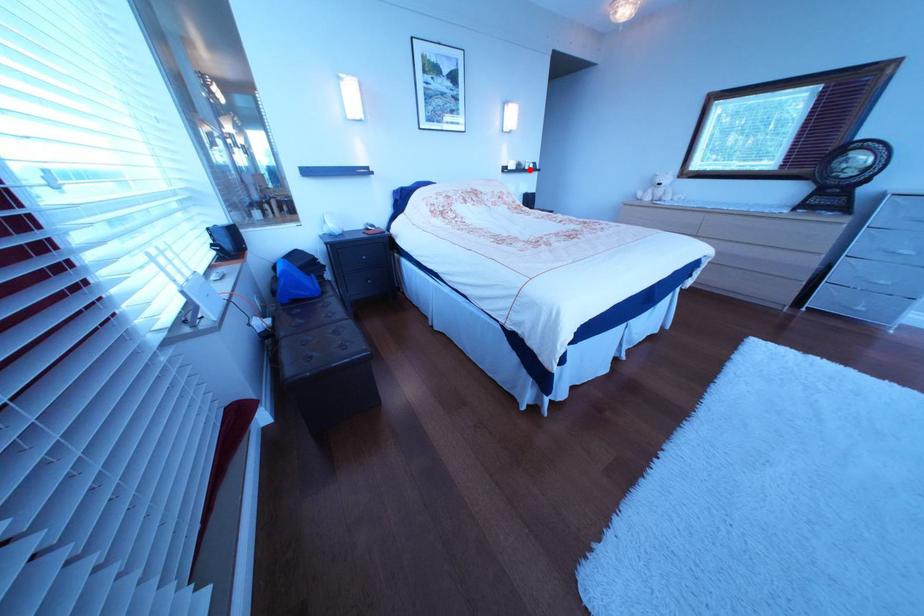
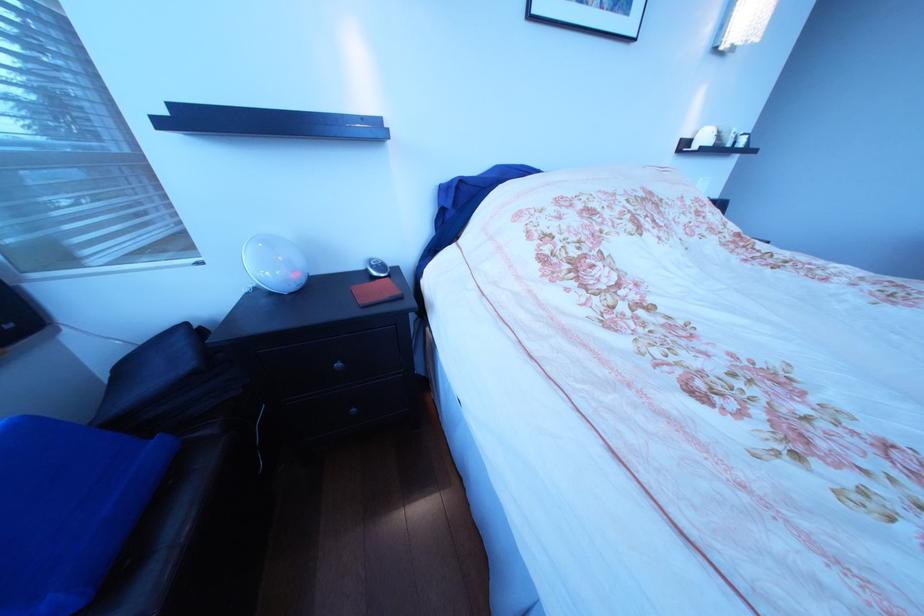
Question: I am providing you with two images of the same scene from different viewpoints. Given a red point in image1, look at the same physical point in image2. Is it:

Choices:
 (A) Closer to the viewpoint
 (B) Farther from the viewpoint

Answer: (B)